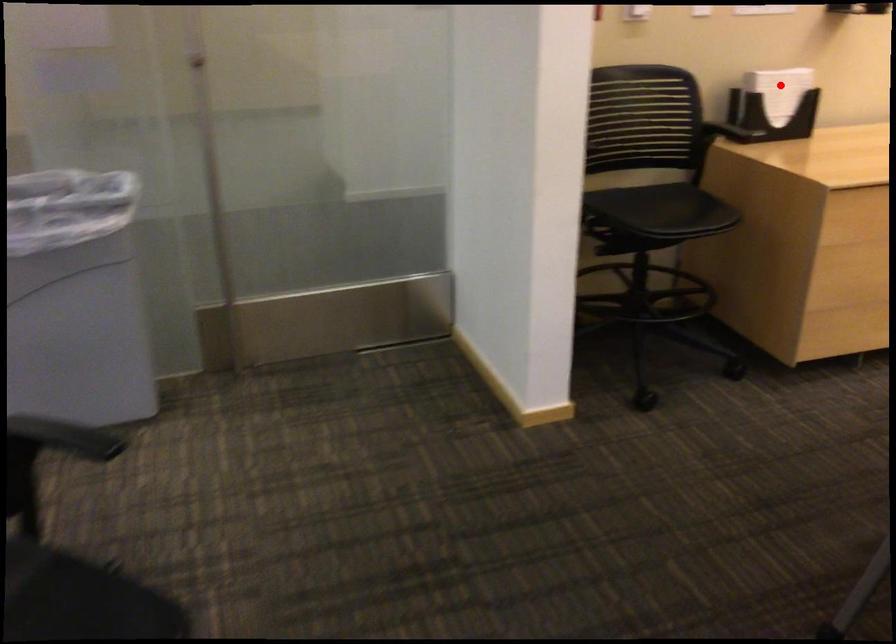
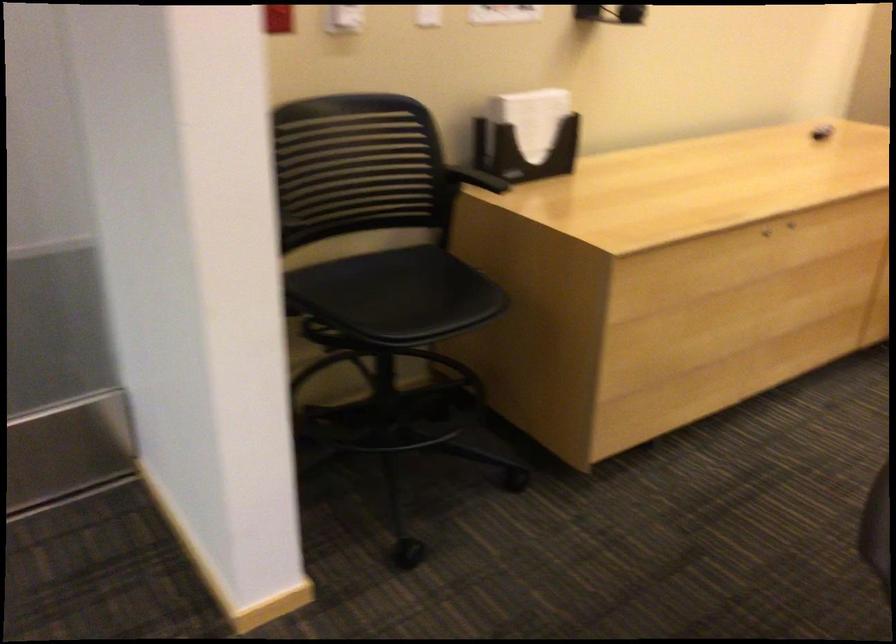
Locate, in the second image, the point that corresponds to the highlighted location in the first image.

(531, 118)